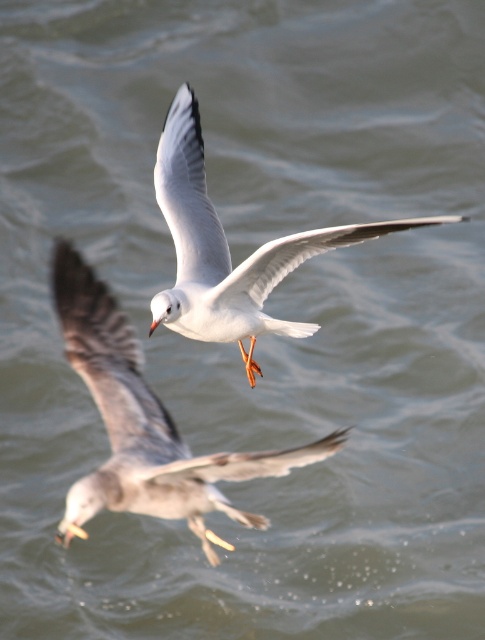
Consider the image. You are standing on a pier and see the white feathered bird at center flying above the water. If you want to throw a small pebble to reach the bird, will the pebble travel more than 7 meters before hitting the water again?

The white feathered bird at center is 7.28 meters away from the viewer. Since the pebble would follow a parabolic trajectory and land back at the pier, the maximum distance it can reach horizontally is less than the total path length. However, the straight line distance to the bird is 7.28 meters, so if the pebble can reach that horizontal distance, it might hit the bird before falling. But since the question asks if the pebble travels more than 7 meters before hitting water, the answer is yes because the 7

You are observing two birds in the sky. You notice a white feathered bird at center and a white matte bird at center. Which one is positioned to the left?

The white feathered bird at center is positioned to the left of the white matte bird at center.

You are a drone operator trying to capture a photo of the white feathered bird at center. The drone is currently at coordinates point 0.5, 0.5. Which direction should you move the drone to get closer to the bird?

The white feathered bird at center is located at point (145,422). Since the drone is at (242,320), you should move the drone to the right and down to reach the bird.